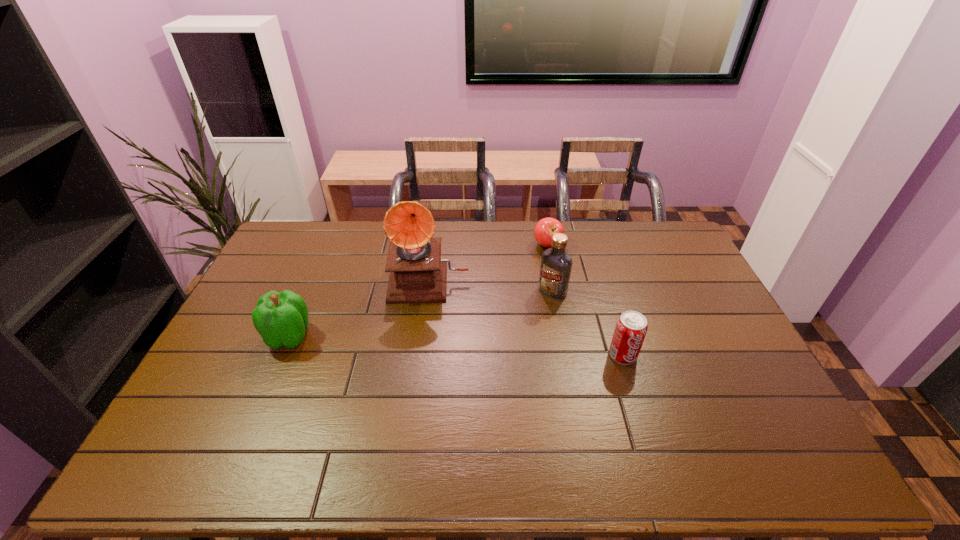
Locate an element on the screen. free spot between the second shortest object and the leftmost object is located at coordinates (456, 346).

Find the location of a particular element. The height and width of the screenshot is (540, 960). free space between the second object from left to right and the leftmost object is located at coordinates (359, 308).

The width and height of the screenshot is (960, 540). Identify the location of free space between the fourth shortest object and the leftmost object. (421, 314).

Locate an element on the screen. empty space between the tallest object and the farthest object is located at coordinates (489, 262).

Locate an element on the screen. Image resolution: width=960 pixels, height=540 pixels. vacant space that's between the tallest object and the leftmost object is located at coordinates (359, 308).

You are a GUI agent. You are given a task and a screenshot of the screen. Output one action in this format:
    pyautogui.click(x=<x>, y=<y>)
    Task: Click on the object that is the third closest one to the apple
    
    Given the screenshot: What is the action you would take?
    pyautogui.click(x=631, y=327)

Image resolution: width=960 pixels, height=540 pixels. Identify the location of object that is the fourth closest to the fourth object from right to left. (631, 327).

Identify the location of vacant area that satisfies the following two spatial constraints: 1. on the front side of the fourth tallest object; 2. on the right side of the vodka. This screenshot has width=960, height=540. (564, 355).

At what (x,y) coordinates should I click in order to perform the action: click on vacant area that satisfies the following two spatial constraints: 1. on the back side of the fourth object from right to left; 2. on the left side of the leftmost object. Please return your answer as a coordinate pair (x, y). Image resolution: width=960 pixels, height=540 pixels. Looking at the image, I should click on (314, 279).